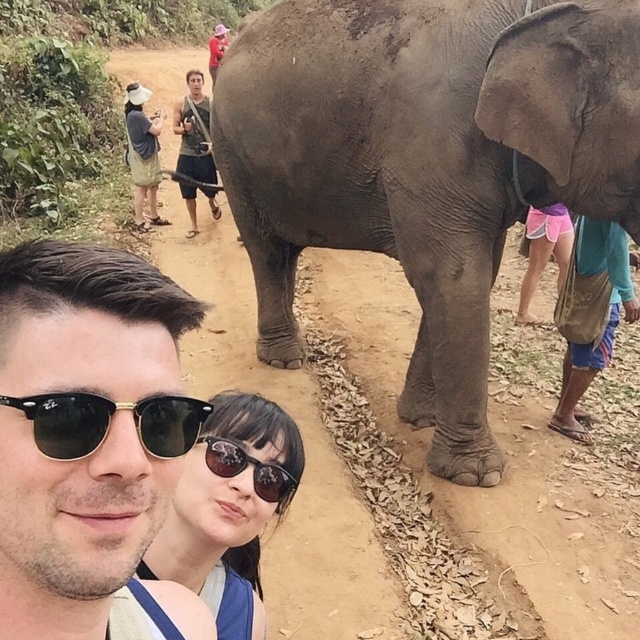
Question: Does sunglasses at center have a larger size compared to black reflective sunglasses at center?

Choices:
 (A) yes
 (B) no

Answer: (A)

Question: Does sunglasses at center appear over matte gray shirt at upper left?

Choices:
 (A) no
 (B) yes

Answer: (A)

Question: Estimate the real-world distances between objects in this image. Which object is closer to the matte gray shirt at upper left?

Choices:
 (A) pink fabric shorts at lower right
 (B) sunglasses at center
 (C) brown leather belt at center
 (D) gray rough elephant at center

Answer: (C)

Question: Among these points, which one is farthest from the camera?

Choices:
 (A) (250, 438)
 (B) (6, 365)
 (C) (252, 467)

Answer: (A)

Question: Which point is closer to the camera taking this photo?

Choices:
 (A) (205, 122)
 (B) (276, 468)
 (C) (532, 236)
 (D) (173, 419)

Answer: (D)

Question: From the image, what is the correct spatial relationship of pink fabric shorts at lower right in relation to brown leather belt at center?

Choices:
 (A) below
 (B) above

Answer: (A)